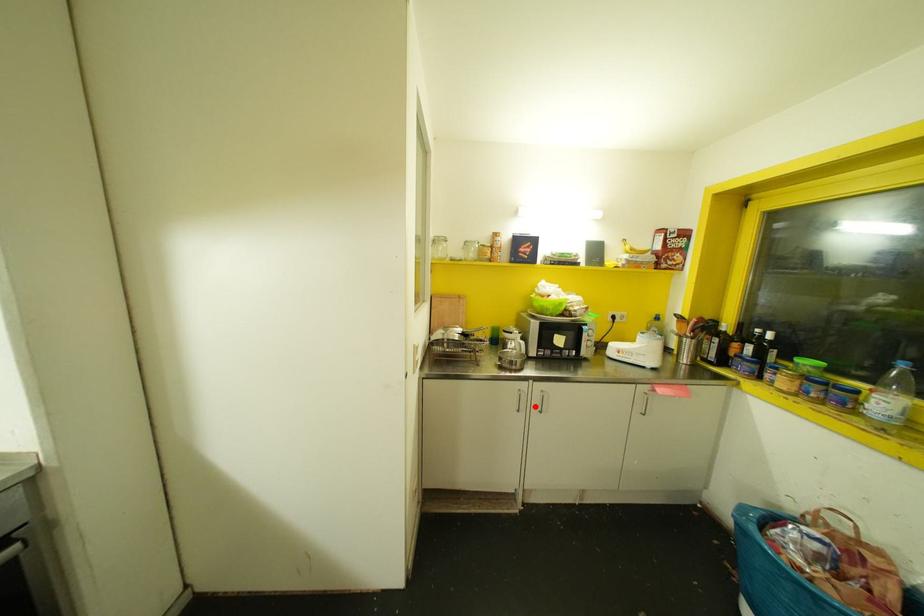
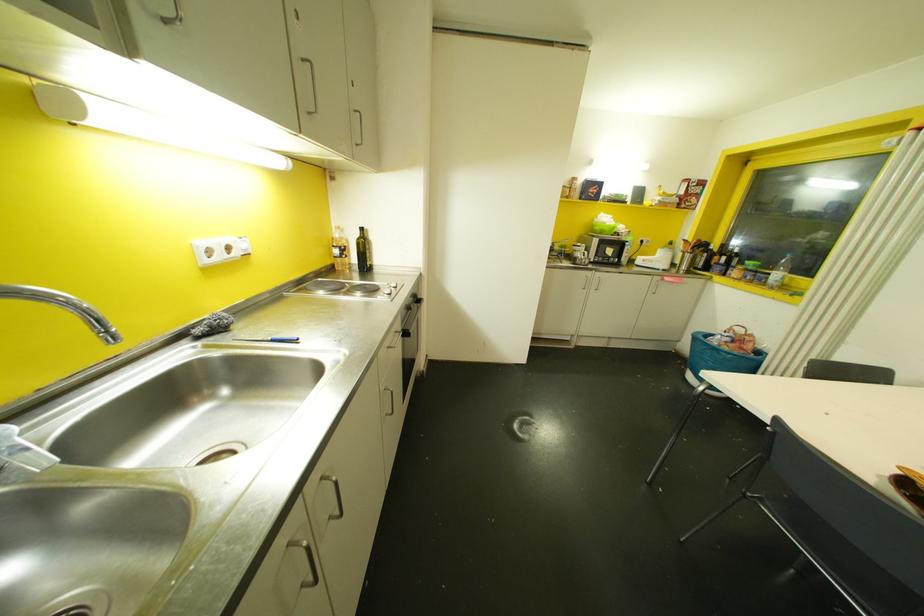
Question: I am providing you with two images of the same scene from different viewpoints. In image1, a red point is highlighted. Considering the same 3D point in image2, which of the following is correct?

Choices:
 (A) It is closer
 (B) It is farther

Answer: (A)